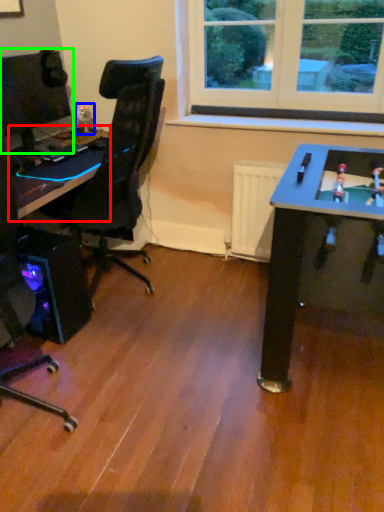
Question: Which object is positioned closest to table (highlighted by a red box)? Select from toy (highlighted by a blue box) and computer monitor (highlighted by a green box).

Choices:
 (A) toy
 (B) computer monitor

Answer: (B)